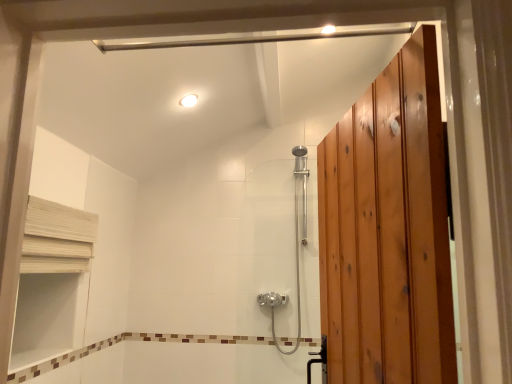
Question: Considering the positions of white glossy light fixture at upper center and white wood shelf at upper left in the image, is white glossy light fixture at upper center taller or shorter than white wood shelf at upper left?

Choices:
 (A) tall
 (B) short

Answer: (B)

Question: Is white glossy light fixture at upper center wider or thinner than white wood shelf at upper left?

Choices:
 (A) thin
 (B) wide

Answer: (B)

Question: Estimate the real-world distances between objects in this image. Which object is farther from the white glossy light fixture at upper center?

Choices:
 (A) white wood shelf at upper left
 (B) polished chrome shower door at center

Answer: (B)

Question: Estimate the real-world distances between objects in this image. Which object is closer to the white wood shelf at upper left?

Choices:
 (A) polished chrome shower door at center
 (B) white glossy light fixture at upper center

Answer: (B)